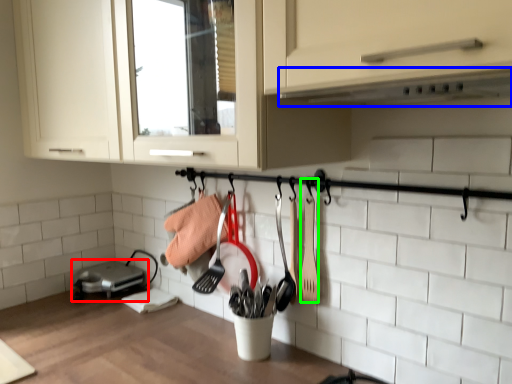
Question: Estimate the real-world distances between objects in this image. Which object is farther from home appliance (highlighted by a red box), exhaust hood (highlighted by a blue box) or spatula (highlighted by a green box)?

Choices:
 (A) exhaust hood
 (B) spatula

Answer: (A)